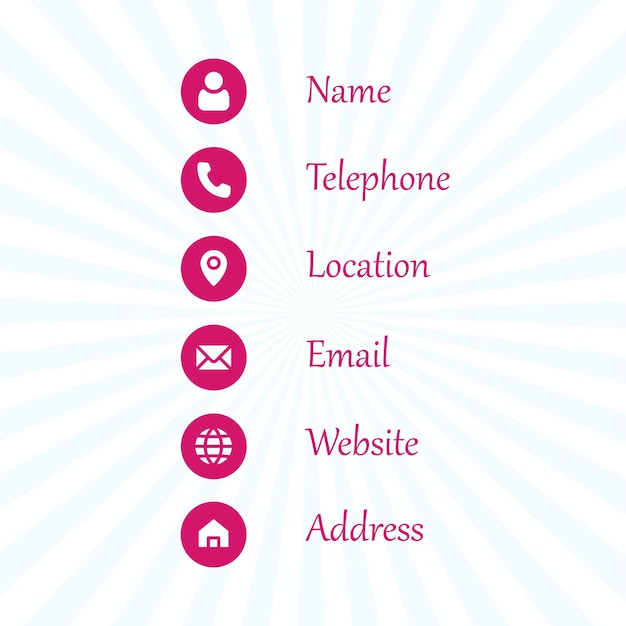
Locate an element on the screen. This screenshot has height=626, width=626. telephone is located at coordinates (314, 177), (325, 176), (337, 178), (350, 178), (364, 178), (384, 180), (403, 181), (419, 180), (443, 182).